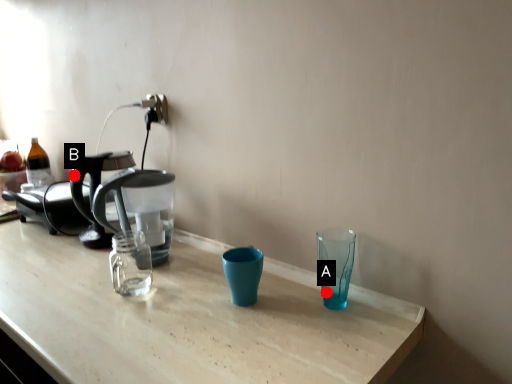
Question: Two points are circled on the image, labeled by A and B beside each circle. Which point appears closest to the camera in this image?

Choices:
 (A) A is closer
 (B) B is closer

Answer: (A)